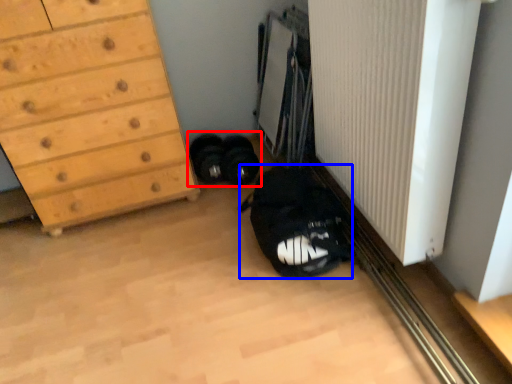
Question: Which of the following is the closest to the observer, footwear (highlighted by a red box) or shoulder bag (highlighted by a blue box)?

Choices:
 (A) footwear
 (B) shoulder bag

Answer: (B)